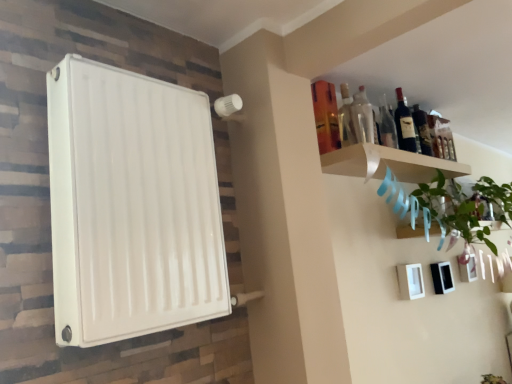
Question: Is dark glass bottle at upper right, which is the fourth bottle in front-to-back order, taller or shorter than dark glass bottle at upper right, which appears as the 3th bottle when viewed from the back?

Choices:
 (A) short
 (B) tall

Answer: (A)

Question: From the image's perspective, relative to dark glass bottle at upper right, which appears as the 3th bottle when viewed from the back, is dark glass bottle at upper right, which is the 1th bottle in right-to-left order, above or below?

Choices:
 (A) below
 (B) above

Answer: (A)

Question: Based on their relative distances, which object is farther from the dark glass bottle at upper right, which is the first bottle in back-to-front order?

Choices:
 (A) green leafy plant at upper right
 (B) white matte picture frame at lower right
 (C) dark glass bottle at upper right, the 2th bottle from the right
 (D) white wood shelf at upper right
 (E) transparent glass bottle at upper right, marked as the 1th bottle in a front-to-back arrangement

Answer: (B)

Question: Which object is positioned closest to the green leafy plant at upper right?

Choices:
 (A) white wood shelf at upper right
 (B) white matte radiator at left
 (C) white matte picture frame at lower right
 (D) dark glass bottle at upper right, the 2th bottle from the right
 (E) transparent glass bottle at upper right, marked as the 1th bottle in a front-to-back arrangement

Answer: (A)